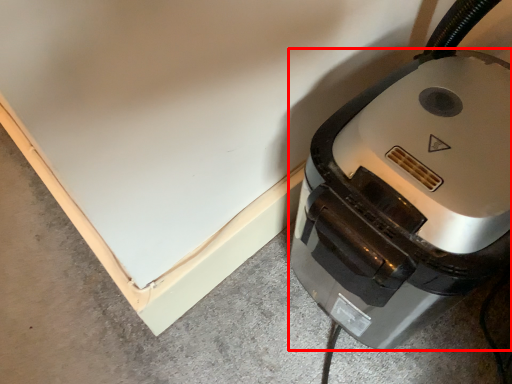
Question: Observing the image, what is the correct spatial positioning of home appliance (annotated by the red box) in reference to concrete?

Choices:
 (A) left
 (B) right

Answer: (B)